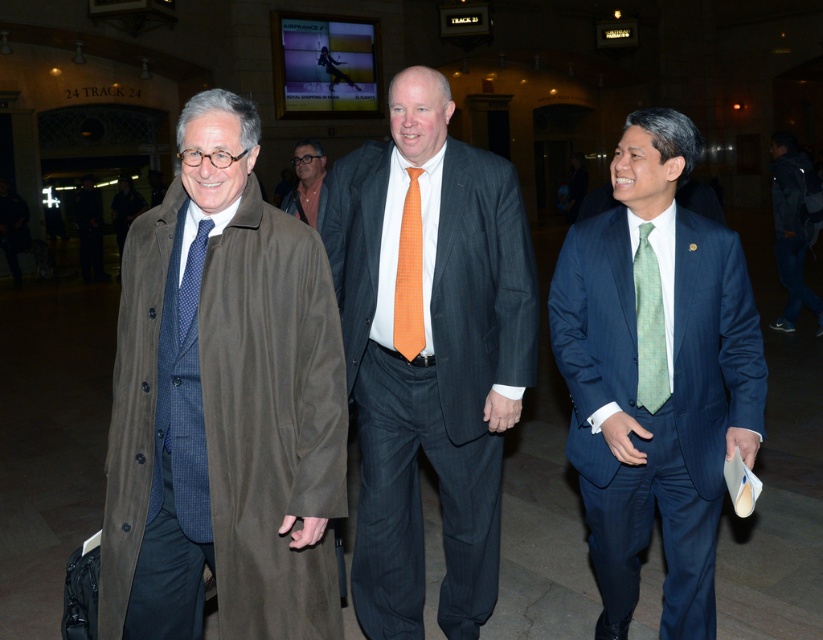
Is point (639, 348) closer to camera compared to point (289, 208)?

Yes.

Measure the distance between green plaid tie at right and camera.

green plaid tie at right is 8.55 feet away from camera.

What are the coordinates of `green plaid tie at right` in the screenshot? It's located at (649, 324).

In order to click on green plaid tie at right in this screenshot , I will do `click(649, 324)`.

Can you confirm if orange pinstripe suit at center is positioned to the right of blue pinstripe suit at center?

No, orange pinstripe suit at center is not to the right of blue pinstripe suit at center.

Looking at this image, who is taller, orange pinstripe suit at center or blue pinstripe suit at center?

orange pinstripe suit at center

Does point (445, 592) lie behind point (644, 132)?

That is True.

Identify the location of orange pinstripe suit at center. This screenshot has width=823, height=640. (429, 353).

Is point (277, 541) less distant than point (798, 308)?

Yes, it is in front of point (798, 308).

In order to click on brown leather coat at left in this screenshot , I will do `click(222, 406)`.

The height and width of the screenshot is (640, 823). Identify the location of brown leather coat at left. (222, 406).